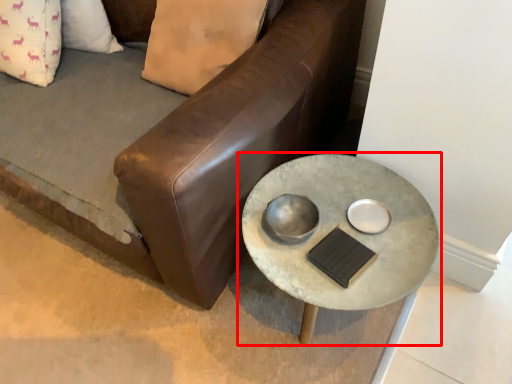
Question: Considering the relative positions of table (annotated by the red box) and studio couch in the image provided, where is table (annotated by the red box) located with respect to the staircase?

Choices:
 (A) right
 (B) left

Answer: (A)